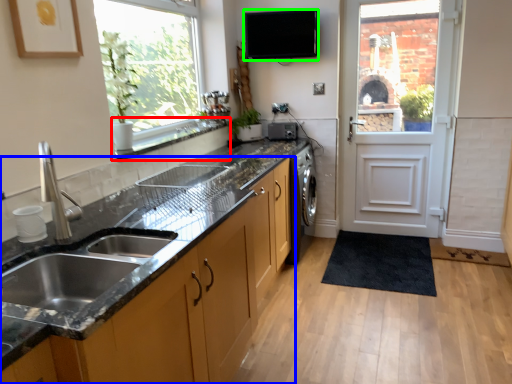
Question: Estimate the real-world distances between objects in this image. Which object is farther from window sill (highlighted by a red box), cabinetry (highlighted by a blue box) or appliance (highlighted by a green box)?

Choices:
 (A) cabinetry
 (B) appliance

Answer: (A)